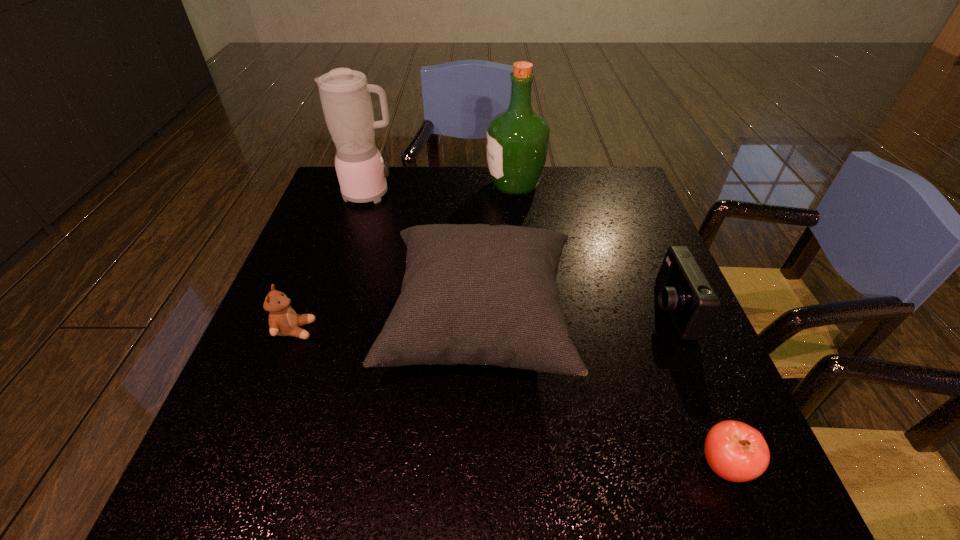
Find the location of a particular element. This screenshot has height=540, width=960. free space located 0.230m on the right of the cushion is located at coordinates (680, 326).

Locate an element on the screen. The width and height of the screenshot is (960, 540). free location located 0.140m on the front-facing side of the camera is located at coordinates (588, 311).

Identify the location of blank space located 0.300m on the front-facing side of the camera. Image resolution: width=960 pixels, height=540 pixels. (517, 311).

Identify the location of free space located 0.070m on the front-facing side of the camera. click(620, 311).

Locate an element on the screen. Image resolution: width=960 pixels, height=540 pixels. vacant space located on the front-facing side of the teddy bear is located at coordinates (459, 330).

Where is `vacant point located 0.140m on the left of the nearest object`? This screenshot has height=540, width=960. vacant point located 0.140m on the left of the nearest object is located at coordinates (612, 465).

Locate an element on the screen. liquor at the far edge is located at coordinates (517, 139).

This screenshot has width=960, height=540. What are the coordinates of `food processor at the far edge` in the screenshot? It's located at (345, 96).

This screenshot has height=540, width=960. Find the location of `object that is at the near edge`. object that is at the near edge is located at coordinates (735, 451).

The width and height of the screenshot is (960, 540). What are the coordinates of `food processor located at the left edge` in the screenshot? It's located at (345, 96).